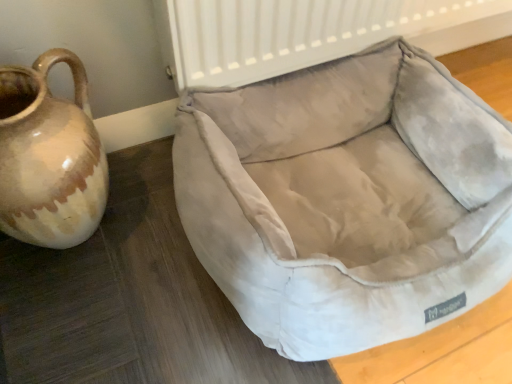
Locate an element on the screen. This screenshot has width=512, height=384. suede-like beige dog bed at center is located at coordinates (347, 200).

What do you see at coordinates (347, 200) in the screenshot?
I see `suede-like beige dog bed at center` at bounding box center [347, 200].

What is the approximate height of brown glazed jug at left?

30.82 centimeters.

What do you see at coordinates (49, 157) in the screenshot? This screenshot has width=512, height=384. I see `brown glazed jug at left` at bounding box center [49, 157].

What is the approximate width of brown glazed jug at left?

The width of brown glazed jug at left is 8.02 inches.

The width and height of the screenshot is (512, 384). In order to click on brown glazed jug at left in this screenshot , I will do `click(49, 157)`.

The image size is (512, 384). What are the coordinates of `suede-like beige dog bed at center` in the screenshot? It's located at (347, 200).

Considering the positions of objects brown glazed jug at left and suede-like beige dog bed at center in the image provided, who is more to the right, brown glazed jug at left or suede-like beige dog bed at center?

suede-like beige dog bed at center is more to the right.

Considering their positions, is brown glazed jug at left located in front of or behind suede-like beige dog bed at center?

In the image, brown glazed jug at left appears behind suede-like beige dog bed at center.

Does point (53, 190) lie behind point (508, 243)?

No, it is not.

From the image's perspective, is brown glazed jug at left beneath suede-like beige dog bed at center?

No, from the image's perspective, brown glazed jug at left is not below suede-like beige dog bed at center.

From a real-world perspective, between brown glazed jug at left and suede-like beige dog bed at center, who is vertically higher?

brown glazed jug at left, from a real-world perspective.

Is brown glazed jug at left wider than suede-like beige dog bed at center?

In fact, brown glazed jug at left might be narrower than suede-like beige dog bed at center.

Considering the sizes of brown glazed jug at left and suede-like beige dog bed at center in the image, is brown glazed jug at left taller or shorter than suede-like beige dog bed at center?

Clearly, brown glazed jug at left is taller compared to suede-like beige dog bed at center.

Considering the sizes of objects brown glazed jug at left and suede-like beige dog bed at center in the image provided, who is bigger, brown glazed jug at left or suede-like beige dog bed at center?

suede-like beige dog bed at center.

Would you say brown glazed jug at left is inside or outside suede-like beige dog bed at center?

brown glazed jug at left is spatially situated outside suede-like beige dog bed at center.

Is brown glazed jug at left with suede-like beige dog bed at center?

brown glazed jug at left and suede-like beige dog bed at center are not in contact.

Is brown glazed jug at left oriented away from suede-like beige dog bed at center?

No.

How many degrees apart are the facing directions of brown glazed jug at left and suede-like beige dog bed at center?

There is a 0.00307-degree angle between the facing directions of brown glazed jug at left and suede-like beige dog bed at center.

Identify the location of jug that appears on the left of suede-like beige dog bed at center. tap(49, 157).

Is suede-like beige dog bed at center to the right of brown glazed jug at left from the viewer's perspective?

Yes, suede-like beige dog bed at center is to the right of brown glazed jug at left.

Consider the image. Is suede-like beige dog bed at center positioned in front of brown glazed jug at left?

Yes, it is.

Considering the points (379, 214) and (30, 109), which point is behind, point (379, 214) or point (30, 109)?

The point (379, 214) is behind.

From the image's perspective, is suede-like beige dog bed at center positioned above or below brown glazed jug at left?

suede-like beige dog bed at center is below brown glazed jug at left.

From a real-world perspective, between suede-like beige dog bed at center and brown glazed jug at left, who is vertically higher?

brown glazed jug at left.

Considering the sizes of suede-like beige dog bed at center and brown glazed jug at left in the image, is suede-like beige dog bed at center wider or thinner than brown glazed jug at left?

Clearly, suede-like beige dog bed at center has more width compared to brown glazed jug at left.

Is suede-like beige dog bed at center taller or shorter than brown glazed jug at left?

In the image, suede-like beige dog bed at center appears to be shorter than brown glazed jug at left.

Is suede-like beige dog bed at center bigger than brown glazed jug at left?

Indeed, suede-like beige dog bed at center has a larger size compared to brown glazed jug at left.

Is suede-like beige dog bed at center inside the boundaries of brown glazed jug at left, or outside?

suede-like beige dog bed at center is not enclosed by brown glazed jug at left.

Is suede-like beige dog bed at center next to brown glazed jug at left and touching it?

No, suede-like beige dog bed at center is not in contact with brown glazed jug at left.

Is suede-like beige dog bed at center oriented away from brown glazed jug at left?

No, suede-like beige dog bed at center is not facing the opposite direction of brown glazed jug at left.

From the picture: Measure the distance from suede-like beige dog bed at center to brown glazed jug at left.

They are 35.81 centimeters apart.

I want to click on dog bed beneath the brown glazed jug at left (from a real-world perspective), so click(347, 200).

This screenshot has height=384, width=512. I want to click on jug above the suede-like beige dog bed at center (from the image's perspective), so click(x=49, y=157).

The image size is (512, 384). In order to click on dog bed below the brown glazed jug at left (from the image's perspective) in this screenshot , I will do `click(347, 200)`.